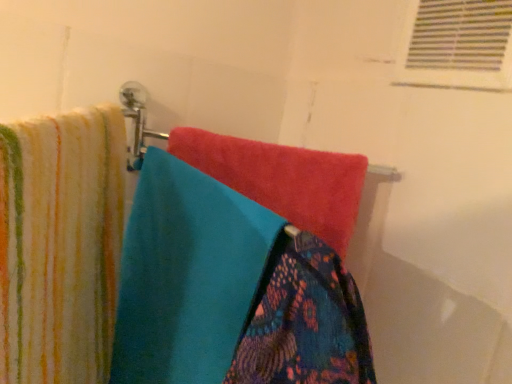
Question: Is striped cotton towel at left, marked as the third towel in a right-to-left arrangement, inside the boundaries of turquoise soft towel at center, the 2th towel from the left, or outside?

Choices:
 (A) outside
 (B) inside

Answer: (A)

Question: From a real-world perspective, is striped cotton towel at left, marked as the third towel in a right-to-left arrangement, positioned above or below turquoise soft towel at center, the 2th towel from the left?

Choices:
 (A) below
 (B) above

Answer: (B)

Question: Which object is the closest to the patterned fabric towel at center, which is the third towel from left to right?

Choices:
 (A) turquoise soft towel at center, the 2th towel from the left
 (B) striped cotton towel at left, marked as the third towel in a right-to-left arrangement
 (C) white plastic vent at upper right

Answer: (A)

Question: Which object is positioned farthest from the turquoise soft towel at center, the 2th towel from the left?

Choices:
 (A) striped cotton towel at left, marked as the third towel in a right-to-left arrangement
 (B) white plastic vent at upper right
 (C) patterned fabric towel at center, which is the third towel from left to right

Answer: (B)